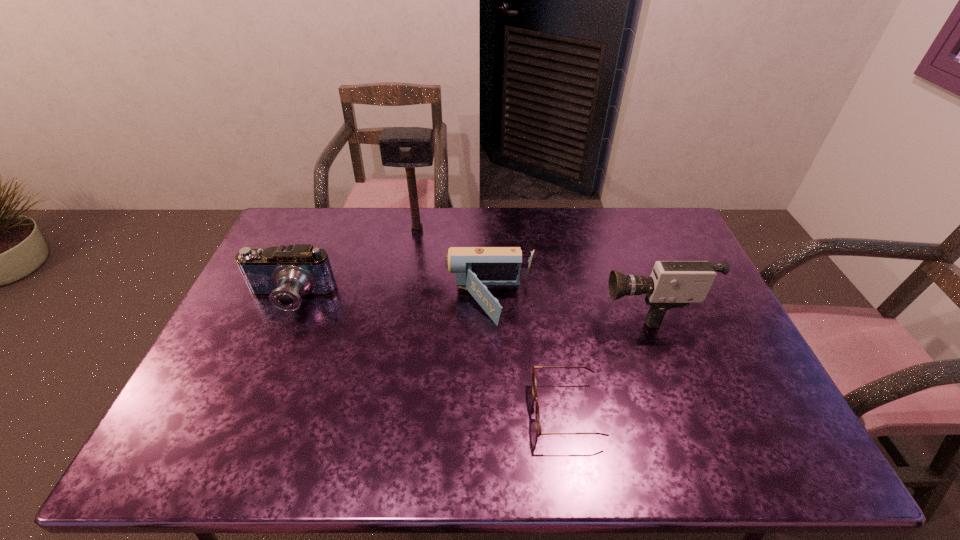
Locate an element on the screen. The width and height of the screenshot is (960, 540). object that is at the near edge is located at coordinates (534, 387).

Identify the location of object present at the left edge. This screenshot has width=960, height=540. (284, 273).

The height and width of the screenshot is (540, 960). I want to click on object that is at the right edge, so click(672, 284).

The image size is (960, 540). In order to click on vacant space at the far edge of the desktop in this screenshot , I will do click(329, 227).

This screenshot has width=960, height=540. In the image, there is a desktop. Find the location of `vacant area at the left edge`. vacant area at the left edge is located at coordinates (202, 377).

I want to click on free space between the second camcorder from left to right and the rightmost object, so click(x=567, y=305).

You are a GUI agent. You are given a task and a screenshot of the screen. Output one action in this format:
    pyautogui.click(x=<x>, y=<y>)
    Task: Click on the free space between the shortest object and the leftmost object
    This screenshot has width=960, height=540.
    Given the screenshot: What is the action you would take?
    pyautogui.click(x=428, y=355)

Identify the location of vacant area that lies between the second camcorder from right to left and the leftmost object. (390, 301).

The height and width of the screenshot is (540, 960). What are the coordinates of `free space that is in between the nearest object and the farthest object` in the screenshot? It's located at (492, 321).

This screenshot has width=960, height=540. I want to click on vacant area between the leftmost object and the second tallest object, so click(468, 303).